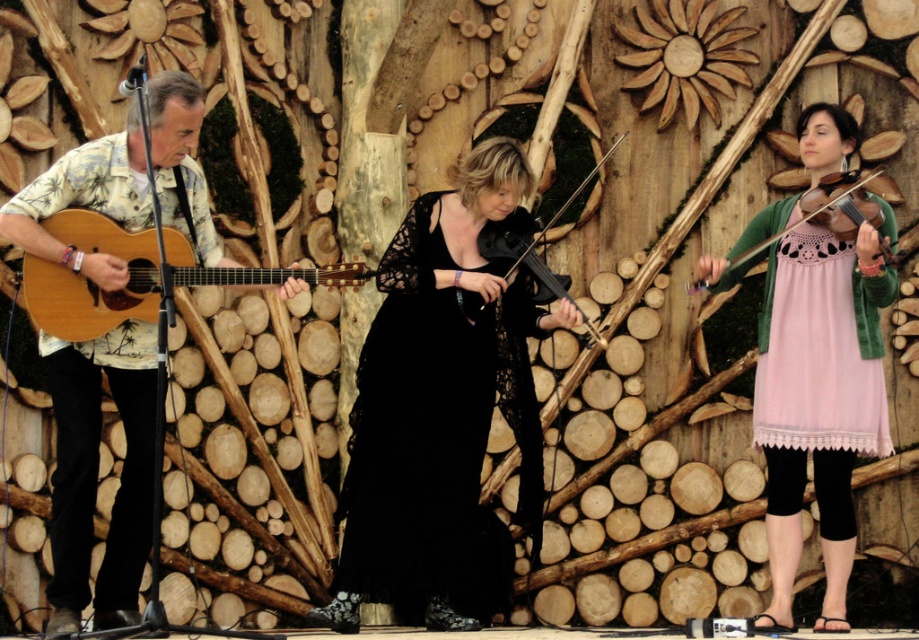
You are designing a stage layout for a performance and need to ensure that the pink lace dress at center and the wooden acoustic guitar at left are visible to the audience. Considering their sizes, which item might require more space to accommodate its width?

The wooden acoustic guitar at left requires more space because its width is greater than the pink lace dress at center.

You are a photographer at the back of the stage. You want to take a photo of the black matte violin at center and the pink lace dress at center. Which object should you zoom in more on to ensure both are in focus?

You should zoom in more on the black matte violin at center because it is smaller than the pink lace dress at center, ensuring both will be in focus.

You are attending a concert and want to take a photo of the performer in the black lace dress at center. Where should you aim your camera to capture her?

You should aim your camera at point (x=437, y=433) to capture the performer in the black lace dress at center.